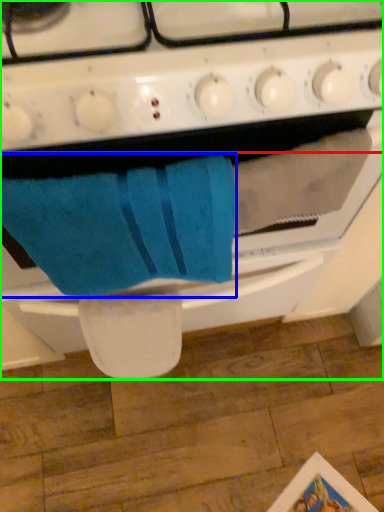
Question: Which object is positioned closest to gas stove (highlighted by a red box)? Select from bath towel (highlighted by a blue box) and oven (highlighted by a green box).

Choices:
 (A) bath towel
 (B) oven

Answer: (B)